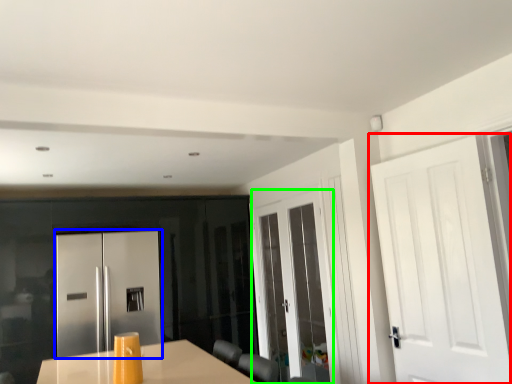
Question: Which object is the farthest from door (highlighted by a red box)? Choose among these: door (highlighted by a blue box) or door (highlighted by a green box).

Choices:
 (A) door
 (B) door

Answer: (A)